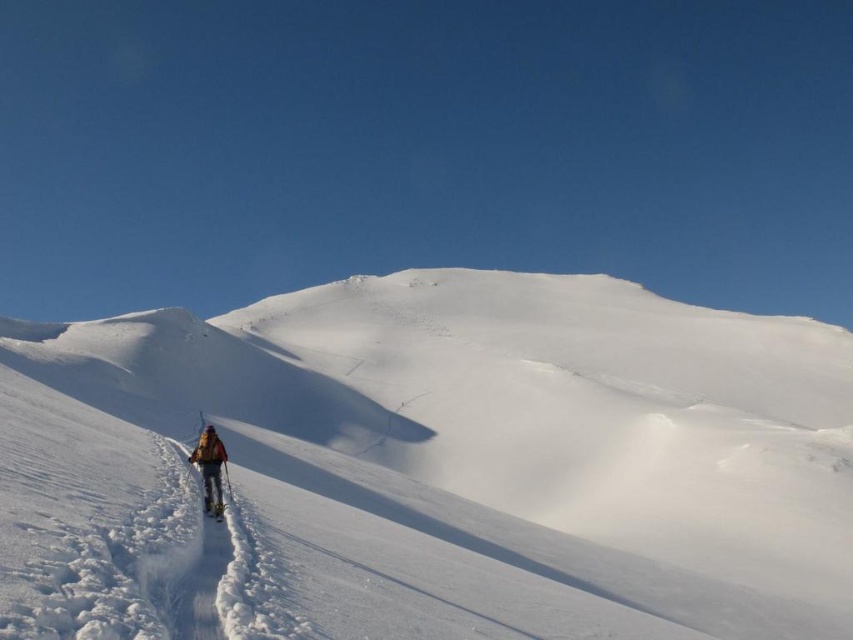
Is yellow fabric jacket at center closer to the viewer compared to white matte ski at lower center?

No, yellow fabric jacket at center is further to the viewer.

Does yellow fabric jacket at center have a greater height compared to white matte ski at lower center?

Correct, yellow fabric jacket at center is much taller as white matte ski at lower center.

Locate an element on the screen. The height and width of the screenshot is (640, 853). yellow fabric jacket at center is located at coordinates (210, 468).

Is white powdery snow at center positioned behind yellow fabric jacket at center?

No, it is in front of yellow fabric jacket at center.

Who is shorter, white powdery snow at center or yellow fabric jacket at center?

Standing shorter between the two is yellow fabric jacket at center.

At what (x,y) coordinates should I click in order to perform the action: click on white powdery snow at center. Please return your answer as a coordinate pair (x, y). This screenshot has width=853, height=640. Looking at the image, I should click on pos(509,449).

Locate an element on the screen. This screenshot has height=640, width=853. white powdery snow at center is located at coordinates (509, 449).

The width and height of the screenshot is (853, 640). What do you see at coordinates (509, 449) in the screenshot?
I see `white powdery snow at center` at bounding box center [509, 449].

Which of these two, white powdery snow at center or white matte ski at lower center, stands taller?

white powdery snow at center

Between point (672, 547) and point (216, 520), which one is positioned behind?

The point (672, 547) is more distant.

Locate an element on the screen. The width and height of the screenshot is (853, 640). white powdery snow at center is located at coordinates (509, 449).